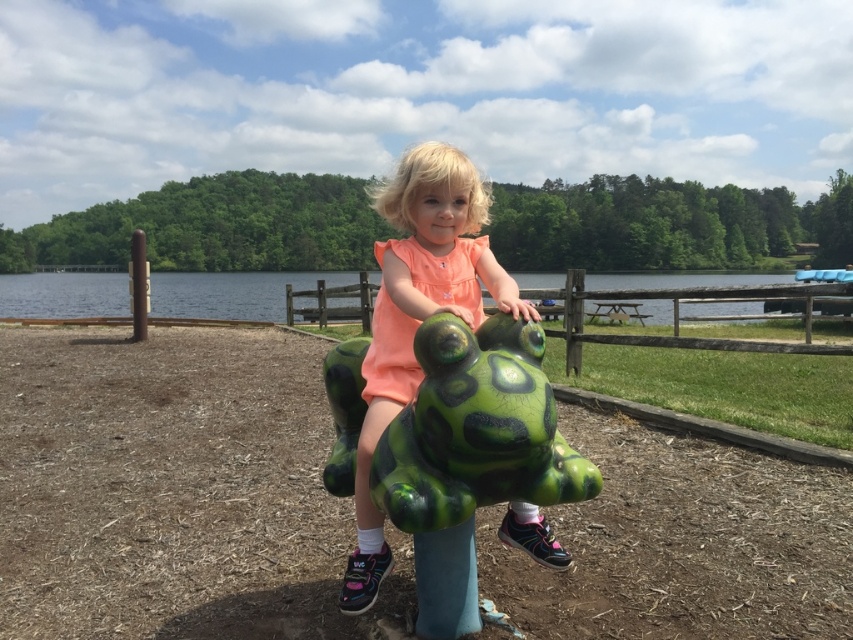
Between matte green plastic frog at center and green plastic water at center, which one appears on the right side from the viewer's perspective?

From the viewer's perspective, matte green plastic frog at center appears more on the right side.

Who is higher up, matte green plastic frog at center or green plastic water at center?

green plastic water at center

Find the location of a particular element. The height and width of the screenshot is (640, 853). matte green plastic frog at center is located at coordinates (416, 314).

Find the location of a particular element. This screenshot has height=640, width=853. matte green plastic frog at center is located at coordinates (x=416, y=314).